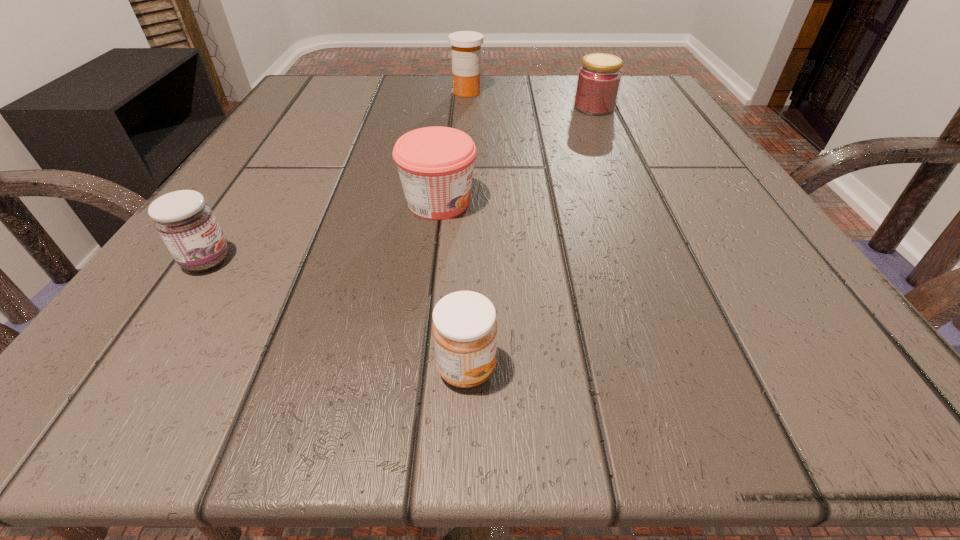
Where is `the farthest object`? the farthest object is located at coordinates (465, 45).

Locate an element on the screen. Image resolution: width=960 pixels, height=540 pixels. the tallest object is located at coordinates (465, 45).

The image size is (960, 540). I want to click on the third nearest jam, so click(435, 164).

This screenshot has width=960, height=540. I want to click on the second farthest object, so click(599, 78).

The width and height of the screenshot is (960, 540). Find the location of `the farthest jam`. the farthest jam is located at coordinates (599, 78).

Locate an element on the screen. The width and height of the screenshot is (960, 540). the second nearest object is located at coordinates (187, 225).

The width and height of the screenshot is (960, 540). In order to click on the second nearest jam in this screenshot , I will do `click(187, 225)`.

The width and height of the screenshot is (960, 540). Find the location of `the nearest jam`. the nearest jam is located at coordinates (464, 327).

Identify the location of free space located 0.250m on the label of the tallest object. Image resolution: width=960 pixels, height=540 pixels. (464, 160).

At what (x,y) coordinates should I click in order to perform the action: click on vacant region located 0.320m on the front label of the third nearest object. Please return your answer as a coordinate pair (x, y). The height and width of the screenshot is (540, 960). Looking at the image, I should click on [x=699, y=202].